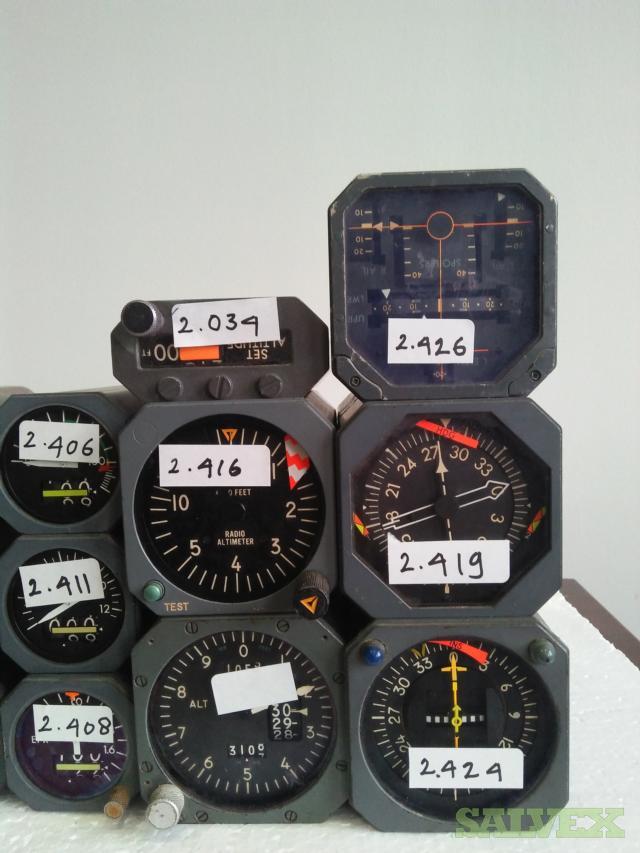
I want to click on white stickers on items, so click(246, 320), click(429, 341), click(448, 548), click(209, 461), click(34, 433), click(70, 572), click(79, 726), click(272, 683).